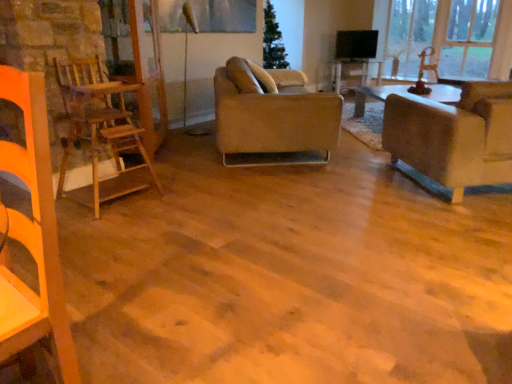
The image size is (512, 384). In order to click on free point in front of wooden ladder at left in this screenshot , I will do click(104, 226).